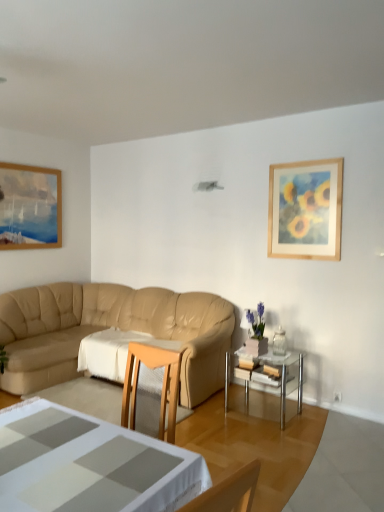
The height and width of the screenshot is (512, 384). In order to click on free space in front of clear glass table at center in this screenshot , I will do `click(274, 436)`.